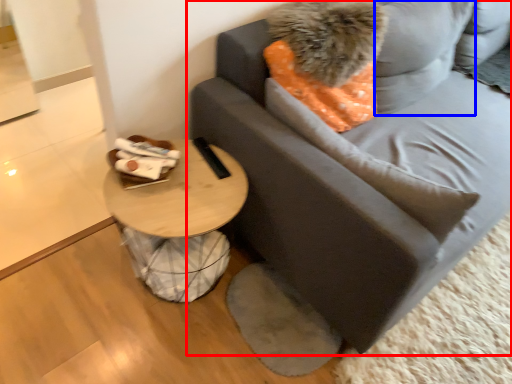
Question: Which object appears closest to the camera in this image, studio couch (highlighted by a red box) or pillow (highlighted by a blue box)?

Choices:
 (A) studio couch
 (B) pillow

Answer: (A)